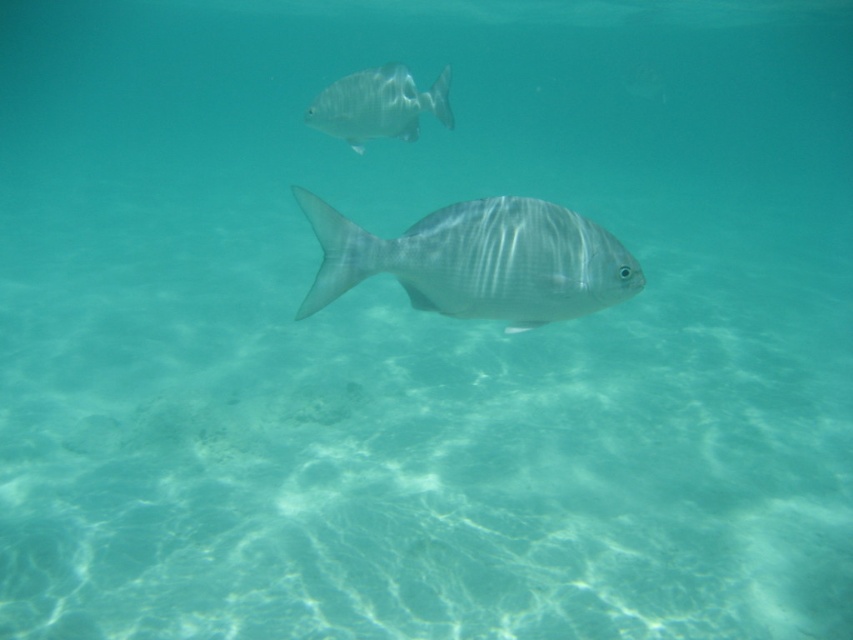
Question: Which of the following is the farthest from the observer?

Choices:
 (A) shiny silver fish at center
 (B) silvery metallic fish at upper center

Answer: (B)

Question: Is shiny silver fish at center to the right of silvery metallic fish at upper center from the viewer's perspective?

Choices:
 (A) no
 (B) yes

Answer: (B)

Question: Is shiny silver fish at center further to the viewer compared to silvery metallic fish at upper center?

Choices:
 (A) no
 (B) yes

Answer: (A)

Question: Can you confirm if shiny silver fish at center is wider than silvery metallic fish at upper center?

Choices:
 (A) yes
 (B) no

Answer: (A)